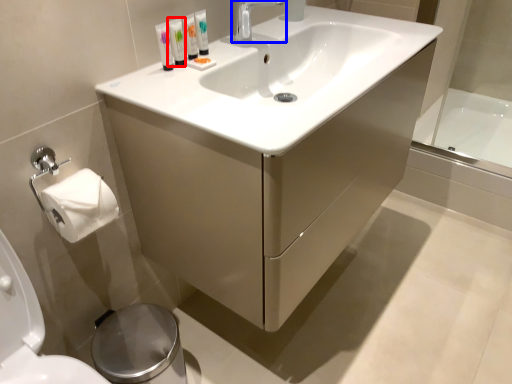
Question: Among these objects, which one is nearest to the camera, mouthwash (highlighted by a red box) or tap (highlighted by a blue box)?

Choices:
 (A) mouthwash
 (B) tap

Answer: (A)